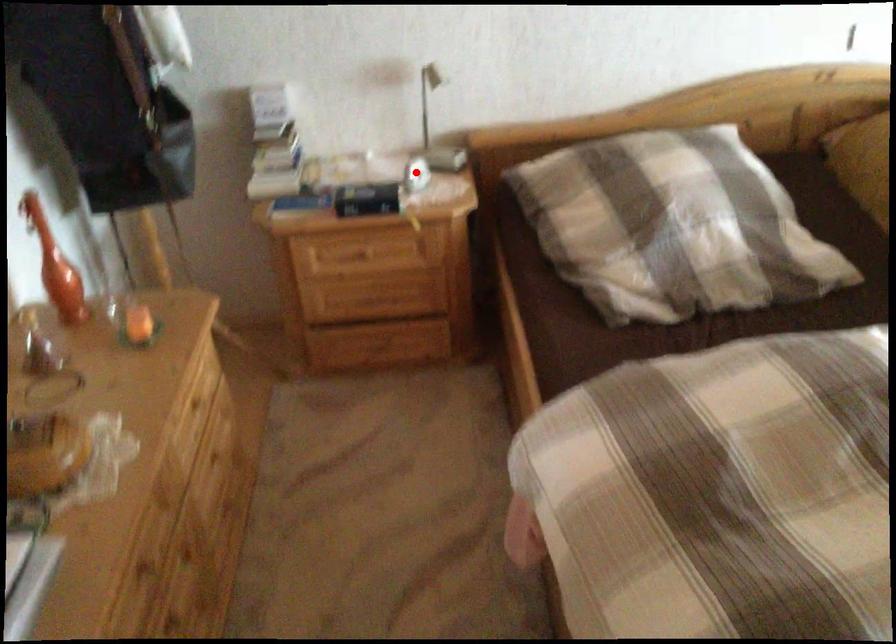
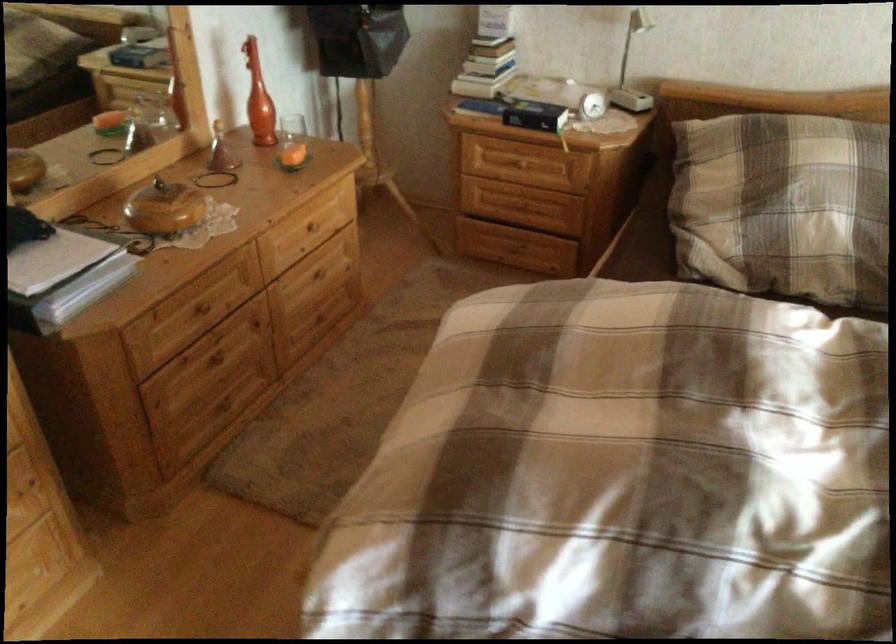
Question: I am providing you with two images of the same scene from different viewpoints. A red point is marked on the first image. At the location where the point appears in image 1, is it still visible in image 2?

Choices:
 (A) Yes
 (B) No

Answer: (A)